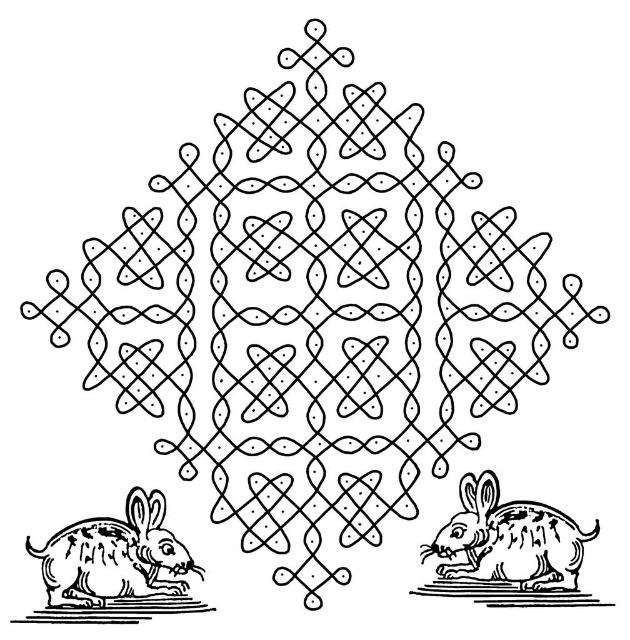
Is point (163, 557) closer to camera compared to point (542, 560)?

Yes, point (163, 557) is closer to viewer.

Does speckled fur rabbit at lower left have a smaller size compared to speckled fur rabbit at lower right?

Actually, speckled fur rabbit at lower left might be larger than speckled fur rabbit at lower right.

Image resolution: width=630 pixels, height=640 pixels. Describe the element at coordinates (117, 557) in the screenshot. I see `speckled fur rabbit at lower left` at that location.

At what (x,y) coordinates should I click in order to perform the action: click on speckled fur rabbit at lower left. Please return your answer as a coordinate pair (x, y). This screenshot has width=630, height=640. Looking at the image, I should click on (117, 557).